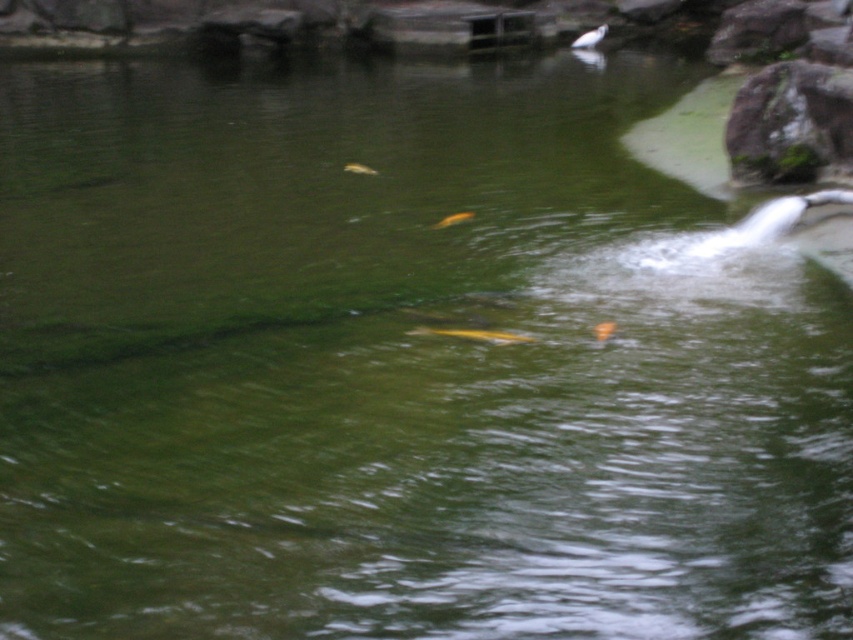
Is point (587, 38) less distant than point (463, 220)?

No.

Who is more distant from viewer, (583, 38) or (463, 211)?

Point (583, 38)

Image resolution: width=853 pixels, height=640 pixels. I want to click on white glossy bird at upper center, so click(x=590, y=36).

Does white glossy bird at upper center have a lesser width compared to translucent yellow fish at center?

In fact, white glossy bird at upper center might be wider than translucent yellow fish at center.

Between white glossy bird at upper center and translucent yellow fish at center, which one has more height?

With more height is white glossy bird at upper center.

Is point (585, 38) positioned in front of point (350, 163)?

No.

Find the location of a particular element. Image resolution: width=853 pixels, height=640 pixels. white glossy bird at upper center is located at coordinates (590, 36).

Is green mossy rock at upper right wider than shiny orange fish at center?

Yes.

Is green mossy rock at upper right shorter than shiny orange fish at center?

No.

This screenshot has height=640, width=853. Find the location of `green mossy rock at upper right`. green mossy rock at upper right is located at coordinates (790, 124).